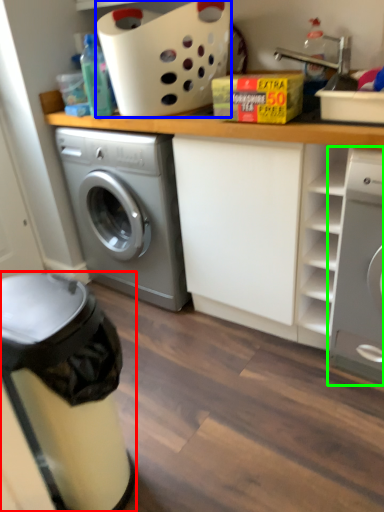
Question: Estimate the real-world distances between objects in this image. Which object is closer to dish washer (highlighted by a red box), basket (highlighted by a blue box) or washing machine (highlighted by a green box)?

Choices:
 (A) basket
 (B) washing machine

Answer: (B)